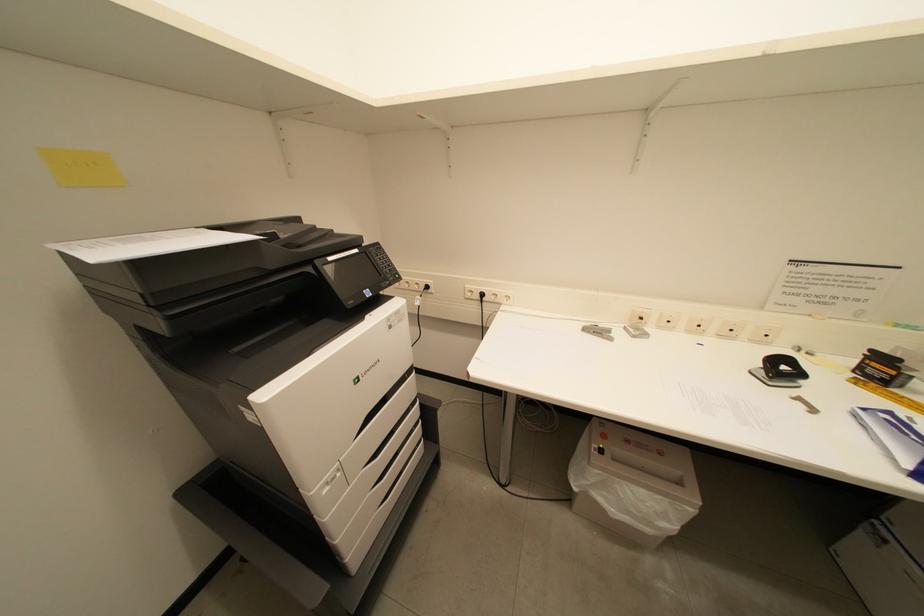
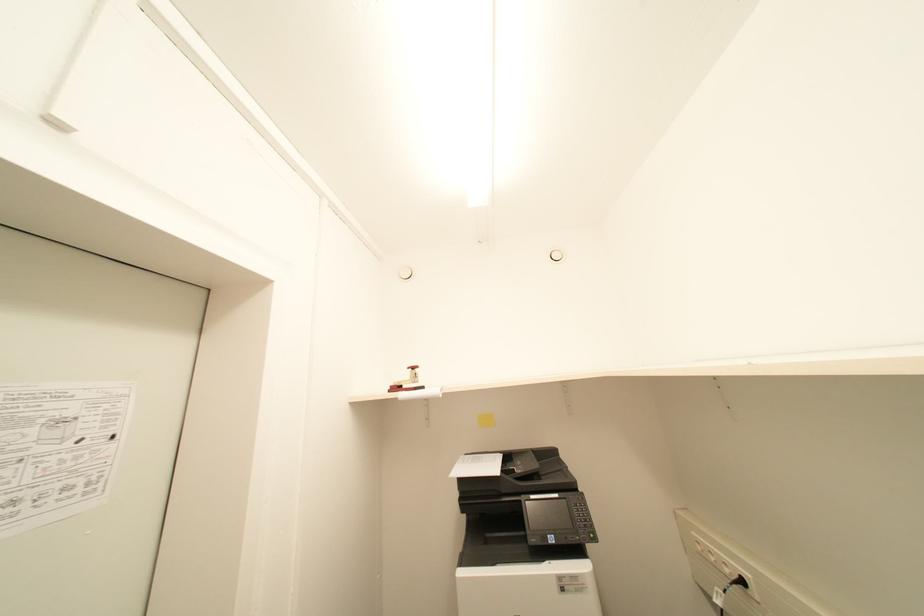
Looking at this image, based on the continuous images, in which direction is the camera rotating?

The rotation direction of the camera is left-up.